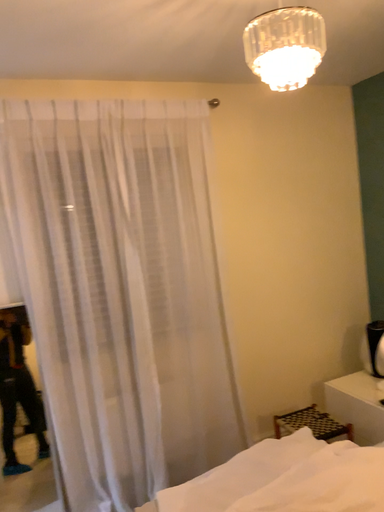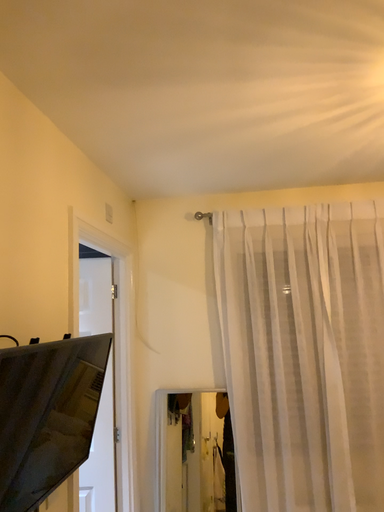
Question: How did the camera likely rotate when shooting the video?

Choices:
 (A) rotated downward
 (B) rotated upward

Answer: (B)